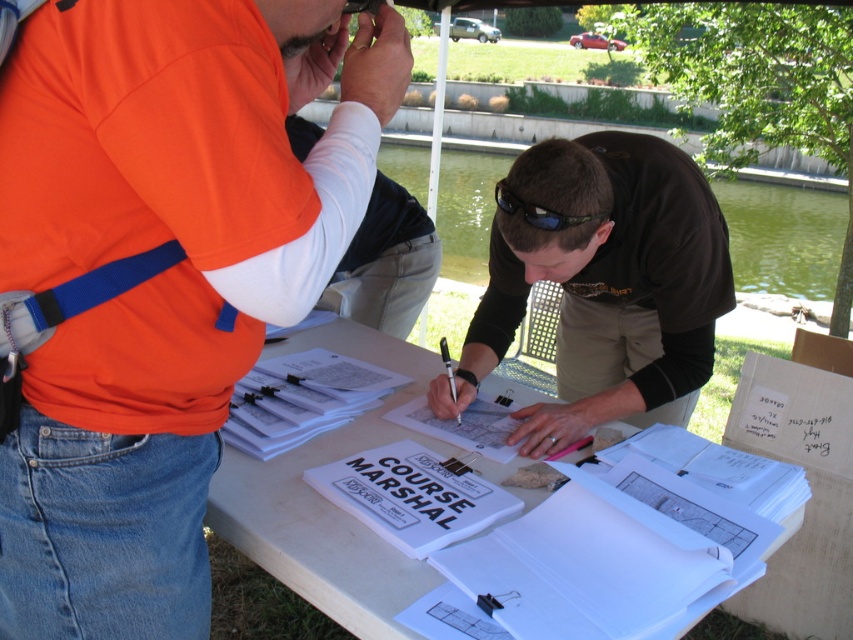
You are a delivery person who needs to place a small package between the black matte shirt at center and the white paper at center. The package is 14 inches long. Will it fit between them?

The black matte shirt at center and white paper at center are 14.32 inches apart from each other. Since the package is 14 inches long, it will fit between them as there is enough space.

You are a photographer trying to capture a clear shot of the black matte shirt at center and the black plastic sunglasses at center from your current position. Which object will appear larger in your photo?

The black matte shirt at center will appear larger in the photo because it is closer to the viewer than the black plastic sunglasses at center.

You are standing at the origin point of the coordinate system. The point at coordinate (x=328, y=500) is located where in relation to the white paper at center?

The point at coordinate (x=328, y=500) corresponds to the white paper at center.